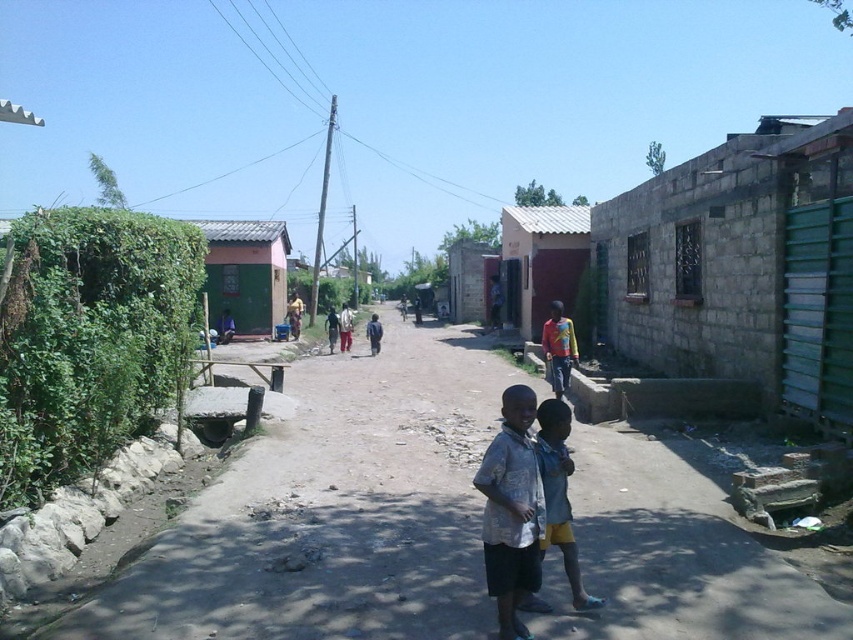
Question: Does light blue printed shirt at center appear on the right side of light blue denim shorts at lower center?

Choices:
 (A) yes
 (B) no

Answer: (B)

Question: Does light blue printed shirt at center have a lesser width compared to light blue denim shorts at lower center?

Choices:
 (A) yes
 (B) no

Answer: (A)

Question: Can you confirm if light blue printed shirt at center is positioned to the left of light blue denim shorts at lower center?

Choices:
 (A) no
 (B) yes

Answer: (B)

Question: Which point is farther from the camera taking this photo?

Choices:
 (A) (521, 506)
 (B) (543, 426)

Answer: (B)